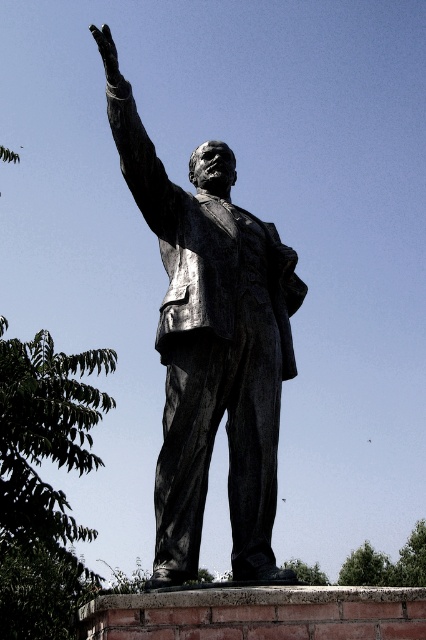
Question: Observing the image, what is the correct spatial positioning of bronze statue at center in reference to bronze statue arm at upper left?

Choices:
 (A) left
 (B) right

Answer: (B)

Question: Which point appears farthest from the camera in this image?

Choices:
 (A) (157, 189)
 (B) (157, 196)

Answer: (B)

Question: Can you confirm if bronze statue at center is smaller than bronze statue arm at upper left?

Choices:
 (A) yes
 (B) no

Answer: (B)

Question: Does bronze statue at center appear under bronze statue arm at upper left?

Choices:
 (A) no
 (B) yes

Answer: (B)